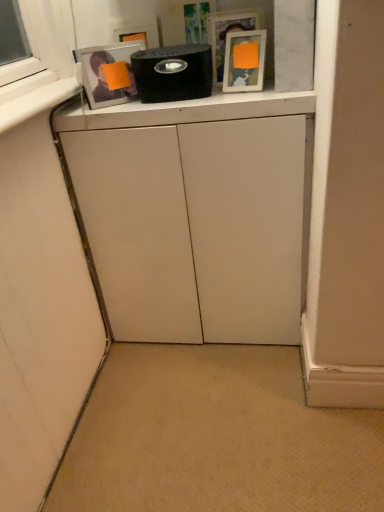
Question: Could you tell me if white matte cabinet at center is facing matte white picture frame at upper center?

Choices:
 (A) yes
 (B) no

Answer: (B)

Question: From a real-world perspective, is white matte cabinet at center beneath matte white picture frame at upper center?

Choices:
 (A) yes
 (B) no

Answer: (A)

Question: Considering the relative sizes of white matte cabinet at center and matte white picture frame at upper center in the image provided, is white matte cabinet at center smaller than matte white picture frame at upper center?

Choices:
 (A) yes
 (B) no

Answer: (B)

Question: Is white matte cabinet at center positioned in front of matte white picture frame at upper center?

Choices:
 (A) no
 (B) yes

Answer: (B)

Question: Considering the relative sizes of white matte cabinet at center and matte white picture frame at upper center in the image provided, is white matte cabinet at center wider than matte white picture frame at upper center?

Choices:
 (A) no
 (B) yes

Answer: (B)

Question: Could matte white picture frame at upper center be considered to be inside white matte cabinet at center?

Choices:
 (A) yes
 (B) no

Answer: (B)

Question: Is the depth of white matte cabinet at center greater than that of black matte speaker at upper center?

Choices:
 (A) no
 (B) yes

Answer: (A)

Question: Does white matte cabinet at center have a lesser height compared to black matte speaker at upper center?

Choices:
 (A) no
 (B) yes

Answer: (A)

Question: Is white matte cabinet at center located outside black matte speaker at upper center?

Choices:
 (A) yes
 (B) no

Answer: (A)

Question: Is white matte cabinet at center facing towards black matte speaker at upper center?

Choices:
 (A) yes
 (B) no

Answer: (B)

Question: Does white matte cabinet at center have a greater height compared to black matte speaker at upper center?

Choices:
 (A) yes
 (B) no

Answer: (A)

Question: Is white matte cabinet at center at the right side of black matte speaker at upper center?

Choices:
 (A) yes
 (B) no

Answer: (A)

Question: Could you tell me if black matte speaker at upper center is facing matte white picture frame at upper center?

Choices:
 (A) no
 (B) yes

Answer: (A)